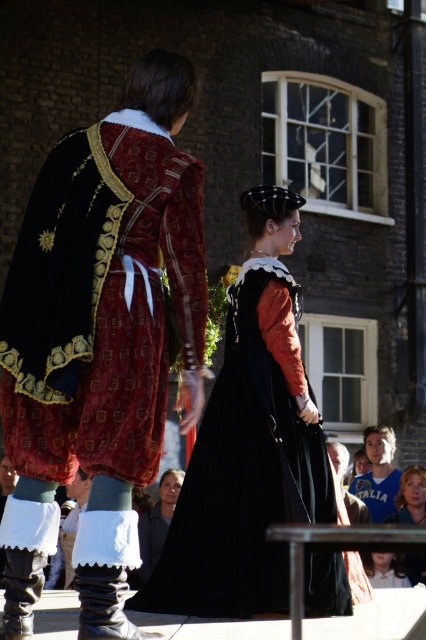
Is black satin dress at center closer to camera compared to smooth brown hair at lower right?

Yes, black satin dress at center is in front of smooth brown hair at lower right.

Is black satin dress at center to the right of smooth brown hair at lower right from the viewer's perspective?

Incorrect, black satin dress at center is not on the right side of smooth brown hair at lower right.

Which is in front, point (196, 493) or point (408, 467)?

Point (196, 493) is in front.

Identify the location of black satin dress at center. (242, 476).

Describe the element at coordinates (118, 321) in the screenshot. This screenshot has width=426, height=640. I see `velvet brocade robe at center` at that location.

Who is higher up, velvet brocade robe at center or blue jersey at lower right?

Positioned higher is velvet brocade robe at center.

Where is `velvet brocade robe at center`? Image resolution: width=426 pixels, height=640 pixels. velvet brocade robe at center is located at coordinates (118, 321).

Is blue jersey at lower right wider than matte black coat at center?

Yes.

Is point (379, 460) less distant than point (184, 474)?

That is False.

Consider the image. Who is more distant from viewer, (365, 497) or (166, 524)?

The point (365, 497) is more distant.

At what (x,y) coordinates should I click in order to perform the action: click on blue jersey at lower right. Please return your answer as a coordinate pair (x, y). The image size is (426, 640). Looking at the image, I should click on tap(377, 474).